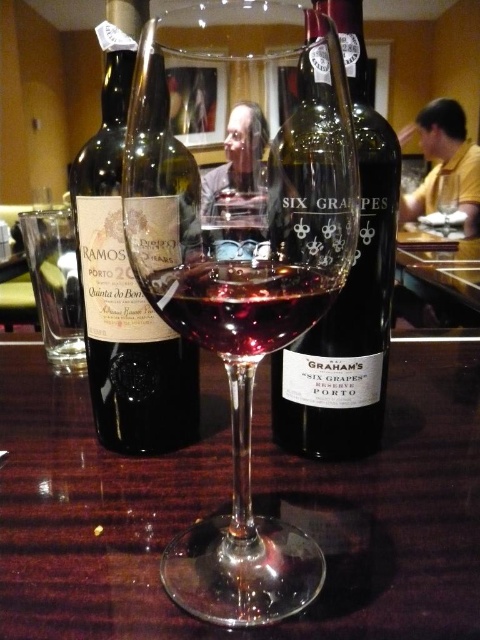
Does glossy wood table at center come behind translucent glass at center?

Yes.

Consider the image. Which is above, glossy wood table at center or translucent glass at center?

translucent glass at center

Identify the location of glossy wood table at center. This screenshot has height=640, width=480. (228, 504).

Can you confirm if glossy wood table at center is wider than transparent glass wine glass at center?

Yes.

In the scene shown: Does glossy wood table at center have a larger size compared to transparent glass wine glass at center?

Indeed, glossy wood table at center has a larger size compared to transparent glass wine glass at center.

At what (x,y) coordinates should I click in order to perform the action: click on glossy wood table at center. Please return your answer as a coordinate pair (x, y). The width and height of the screenshot is (480, 640). Looking at the image, I should click on (228, 504).

Describe the element at coordinates (228, 504) in the screenshot. The width and height of the screenshot is (480, 640). I see `glossy wood table at center` at that location.

Who is more forward, (27,595) or (372,321)?

Point (27,595) is in front.

Which is behind, point (86, 547) or point (273, 433)?

Positioned behind is point (273, 433).

Locate an element on the screen. glossy wood table at center is located at coordinates (228, 504).